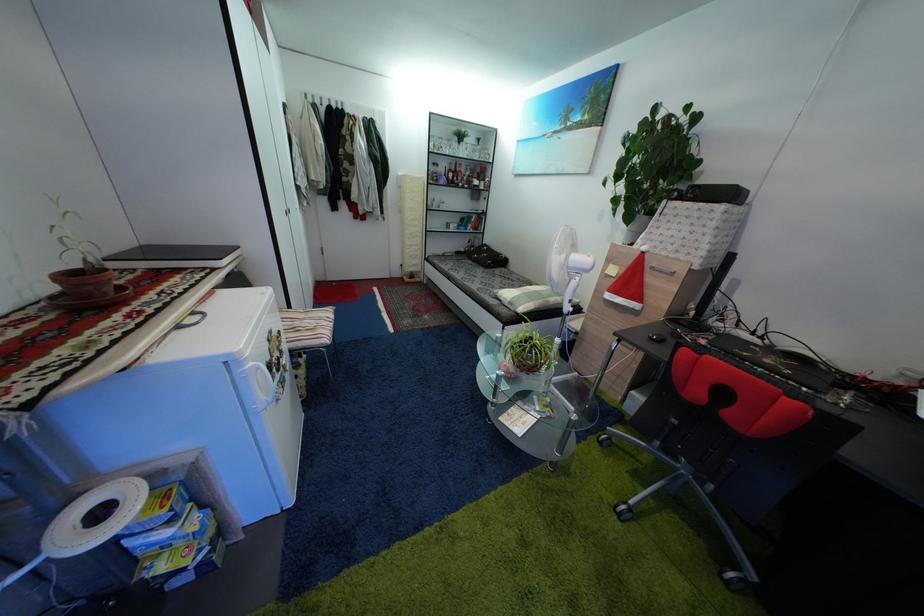
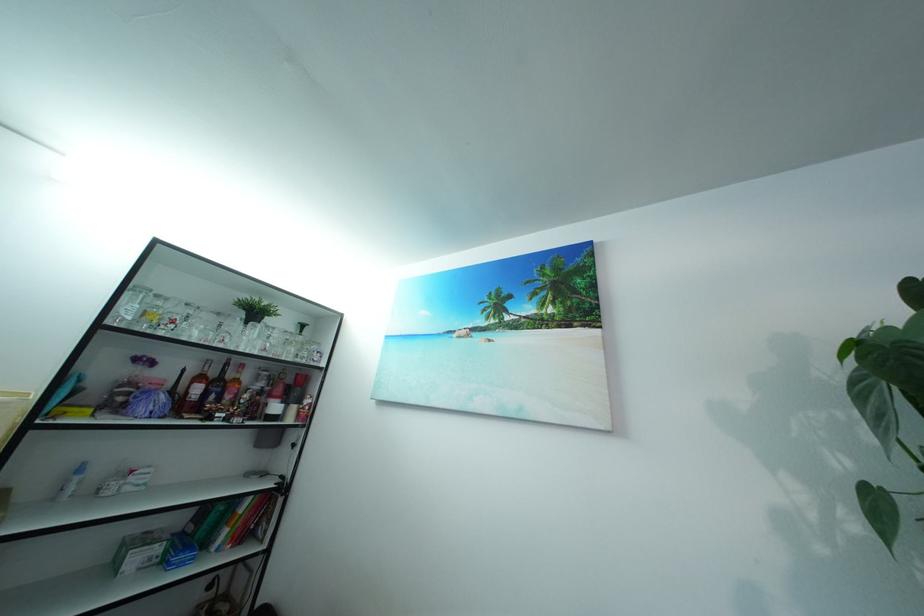
In the second image, find the point that corresponds to the point at 464,180 in the first image.

(226, 391)